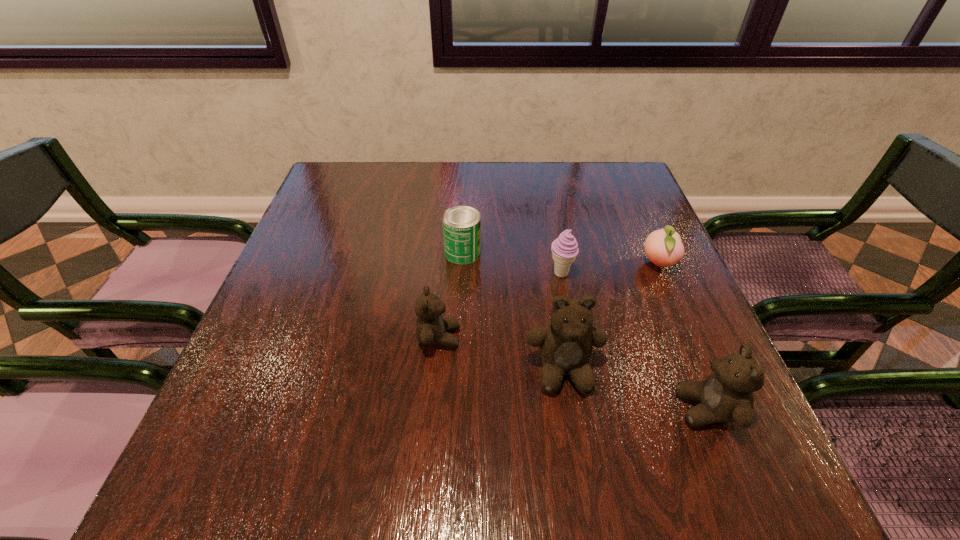
The height and width of the screenshot is (540, 960). I want to click on free space located on the face of the rightmost teddy bear, so click(609, 409).

I want to click on free space located on the face of the rightmost teddy bear, so click(504, 409).

Image resolution: width=960 pixels, height=540 pixels. In order to click on free space located on the back of the peach in this screenshot , I will do `click(639, 221)`.

Identify the location of blank area located 0.230m on the right of the icecream. (675, 274).

Identify the location of vacant space situated on the left of the can. The height and width of the screenshot is (540, 960). (307, 253).

The image size is (960, 540). Identify the location of teddy bear positioned at the right edge. (726, 395).

The height and width of the screenshot is (540, 960). Find the location of `peach present at the right edge`. peach present at the right edge is located at coordinates (663, 247).

This screenshot has width=960, height=540. What are the coordinates of `object at the near right corner` in the screenshot? It's located at (726, 395).

Identify the location of vacant space at the far edge of the desktop. This screenshot has height=540, width=960. (546, 175).

Where is `blank space at the near edge`? blank space at the near edge is located at coordinates click(506, 402).